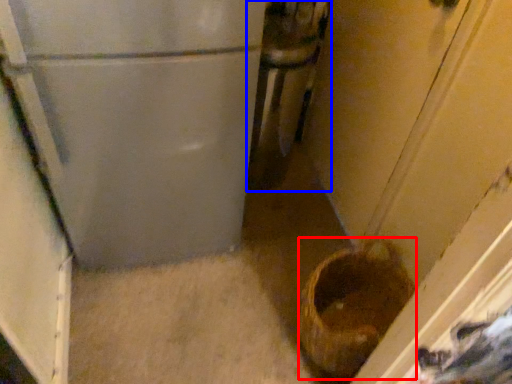
Question: Which of the following is the farthest to the observer, basket container (highlighted by a red box) or appliance (highlighted by a blue box)?

Choices:
 (A) basket container
 (B) appliance

Answer: (B)